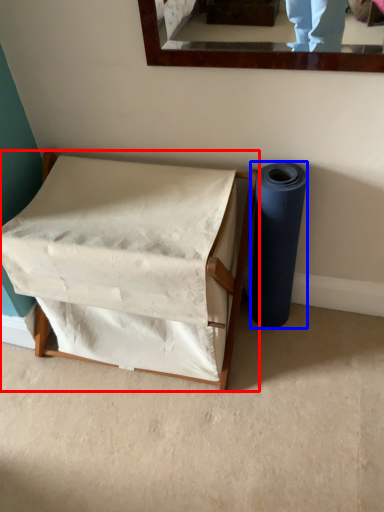
Question: Among these objects, which one is nearest to the camera, furniture (highlighted by a red box) or toilet paper (highlighted by a blue box)?

Choices:
 (A) furniture
 (B) toilet paper

Answer: (A)